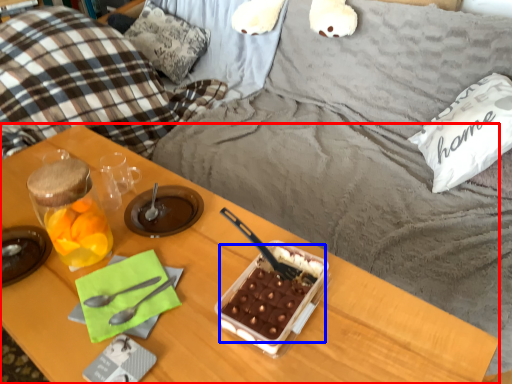
Question: Which object appears closest to the camera in this image, desk (highlighted by a red box) or snack (highlighted by a blue box)?

Choices:
 (A) desk
 (B) snack

Answer: (A)